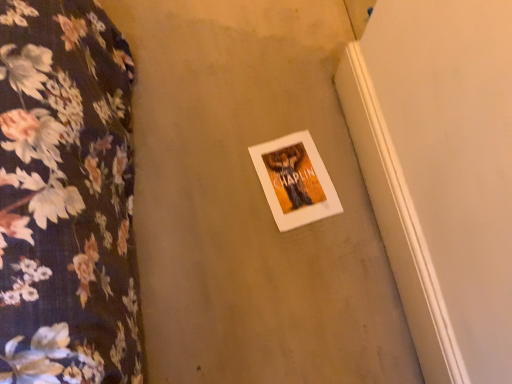
In order to face white paper at center, should I rotate leftwards or rightwards?

To align with it, rotate right about 5.397°.

This screenshot has width=512, height=384. Describe the element at coordinates (295, 180) in the screenshot. I see `white paper at center` at that location.

The width and height of the screenshot is (512, 384). Find the location of `white paper at center`. white paper at center is located at coordinates (295, 180).

You are a GUI agent. You are given a task and a screenshot of the screen. Output one action in this format:
    pyautogui.click(x=<x>, y=<y>)
    Task: Click on the white paper at center
    Image resolution: width=512 pixels, height=384 pixels.
    Given the screenshot: What is the action you would take?
    pyautogui.click(x=295, y=180)